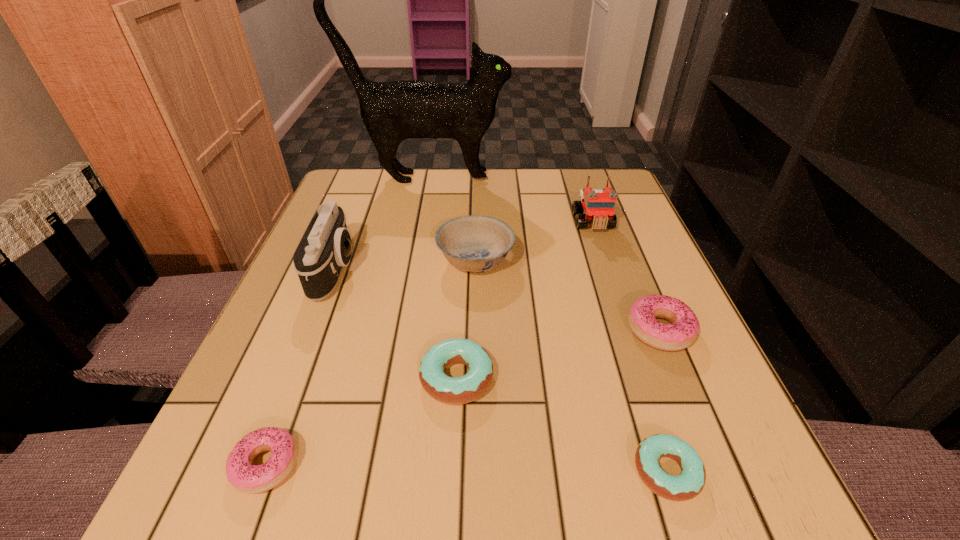
Point out which doughnut is positioned as the second nearest to the seventh nearest object. Please provide its 2D coordinates. Your answer should be formatted as a tuple, i.e. [(x, y)], where the tuple contains the x and y coordinates of a point satisfying the conditions above.

[(449, 390)]

Identify the location of free region that satisfies the following two spatial constraints: 1. on the front lens of the farther blue doughnut; 2. on the left side of the camera. The width and height of the screenshot is (960, 540). (294, 378).

Identify the location of blank area in the image that satisfies the following two spatial constraints: 1. on the front lens of the camera; 2. on the back side of the tallest doughnut. (x=312, y=330).

Locate an element on the screen. The image size is (960, 540). free space that satisfies the following two spatial constraints: 1. on the face of the farthest object; 2. on the left side of the shortest doughnut is located at coordinates (374, 471).

Find the location of a particular element. vacant point that satisfies the following two spatial constraints: 1. on the back side of the bigger blue doughnut; 2. on the face of the farthest object is located at coordinates (467, 178).

Locate an element on the screen. free point that satisfies the following two spatial constraints: 1. on the front lens of the camera; 2. on the back side of the tallest doughnut is located at coordinates (312, 330).